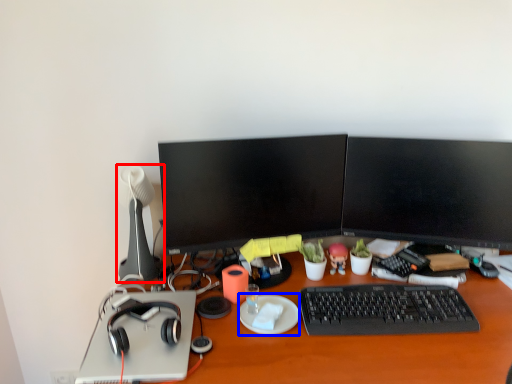
Question: Which object appears farthest to the camera in this image, lamp (highlighted by a red box) or plate (highlighted by a blue box)?

Choices:
 (A) lamp
 (B) plate

Answer: (A)